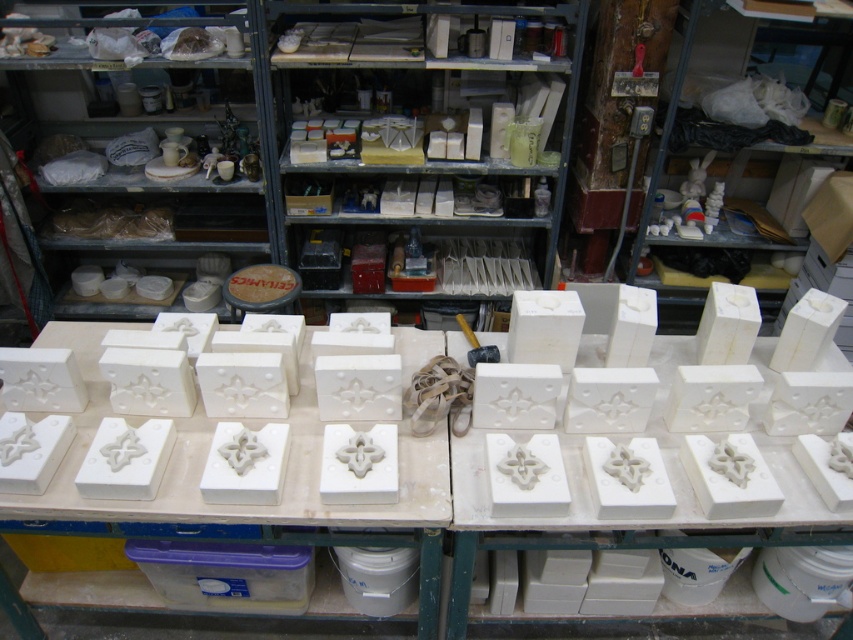
Question: Is white matte blocks at upper right to the right of white matte shelves at upper left from the viewer's perspective?

Choices:
 (A) yes
 (B) no

Answer: (A)

Question: Which of these objects is positioned farthest from the white matte blocks at upper right?

Choices:
 (A) white matte blocks at center
 (B) translucent plastic container at lower center
 (C) white matte shelves at upper left
 (D) white matte shelves at center

Answer: (B)

Question: Is white matte blocks at upper right below translucent plastic container at lower center?

Choices:
 (A) yes
 (B) no

Answer: (B)

Question: Does white matte shelves at center appear on the left side of white matte blocks at center?

Choices:
 (A) yes
 (B) no

Answer: (B)

Question: Which object appears closest to the camera in this image?

Choices:
 (A) white matte shelves at center
 (B) translucent plastic container at lower center
 (C) white matte blocks at upper right
 (D) white matte blocks at center

Answer: (D)

Question: Estimate the real-world distances between objects in this image. Which object is closer to the white matte shelves at center?

Choices:
 (A) white matte blocks at center
 (B) white matte shelves at upper left

Answer: (B)